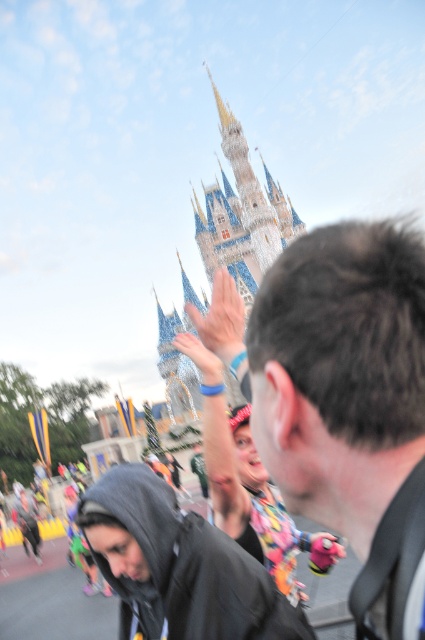
Is black matte jacket at lower left further to the viewer compared to white stone castle at center?

No, black matte jacket at lower left is closer to the viewer.

Describe the element at coordinates (178, 566) in the screenshot. I see `black matte jacket at lower left` at that location.

Which is in front, point (207, 545) or point (251, 176)?

Point (207, 545) is more forward.

Locate an element on the screen. This screenshot has height=640, width=425. black matte jacket at lower left is located at coordinates (178, 566).

Measure the distance between dark brown hair at center and white stone castle at center.

dark brown hair at center is 47.72 meters away from white stone castle at center.

Can you confirm if dark brown hair at center is bigger than white stone castle at center?

Actually, dark brown hair at center might be smaller than white stone castle at center.

Is point (394, 444) positioned after point (258, 243)?

That is False.

Image resolution: width=425 pixels, height=640 pixels. What are the coordinates of `dark brown hair at center` in the screenshot? It's located at (343, 401).

Is dark brown hair at center bigger than black matte jacket at lower left?

Correct, dark brown hair at center is larger in size than black matte jacket at lower left.

Between dark brown hair at center and black matte jacket at lower left, which one has less height?

black matte jacket at lower left

Where is `dark brown hair at center`? This screenshot has height=640, width=425. dark brown hair at center is located at coordinates (343, 401).